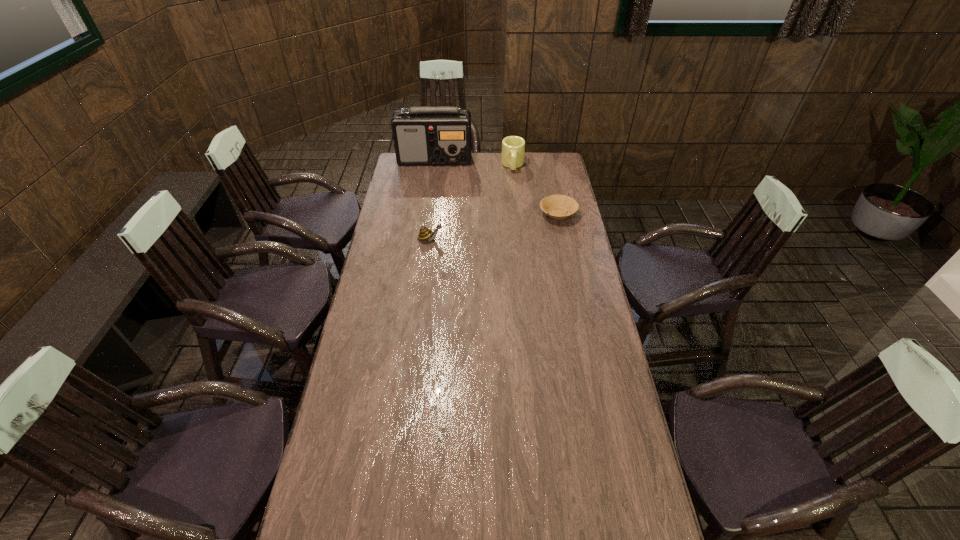
Where is `vacant space on the desktop that is between the snail and the bowl and is positioned with the handle on the side of the mug`? This screenshot has height=540, width=960. vacant space on the desktop that is between the snail and the bowl and is positioned with the handle on the side of the mug is located at coordinates (516, 222).

The image size is (960, 540). What are the coordinates of `vacant space on the desktop that is between the snail and the second nearest object and is positioned on the front panel of the tallest object` in the screenshot? It's located at (498, 226).